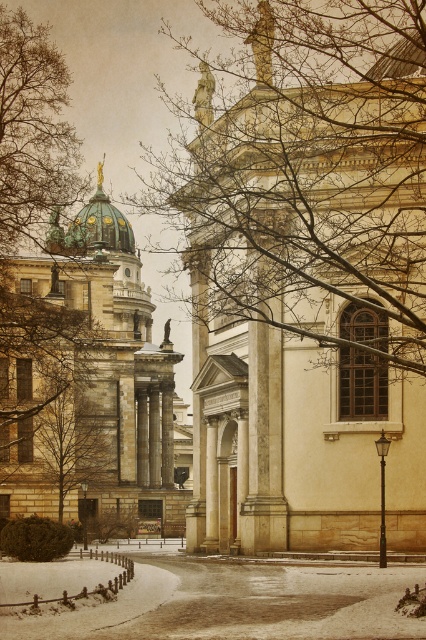
Question: Which point is closer to the camera taking this photo?

Choices:
 (A) (377, 115)
 (B) (31, 317)

Answer: (A)

Question: Which point is closer to the camera?

Choices:
 (A) green marble church at left
 (B) brown leafless tree at left
 (C) bare branches at center

Answer: (C)

Question: Which of the following is the farthest from the observer?

Choices:
 (A) bare branches at center
 (B) green marble church at left
 (C) brown leafless tree at left

Answer: (B)

Question: Is bare branches at center below green marble church at left?

Choices:
 (A) no
 (B) yes

Answer: (A)

Question: Can you confirm if bare branches at center is positioned to the left of green marble church at left?

Choices:
 (A) yes
 (B) no

Answer: (B)

Question: Does bare branches at center appear on the left side of green marble church at left?

Choices:
 (A) no
 (B) yes

Answer: (A)